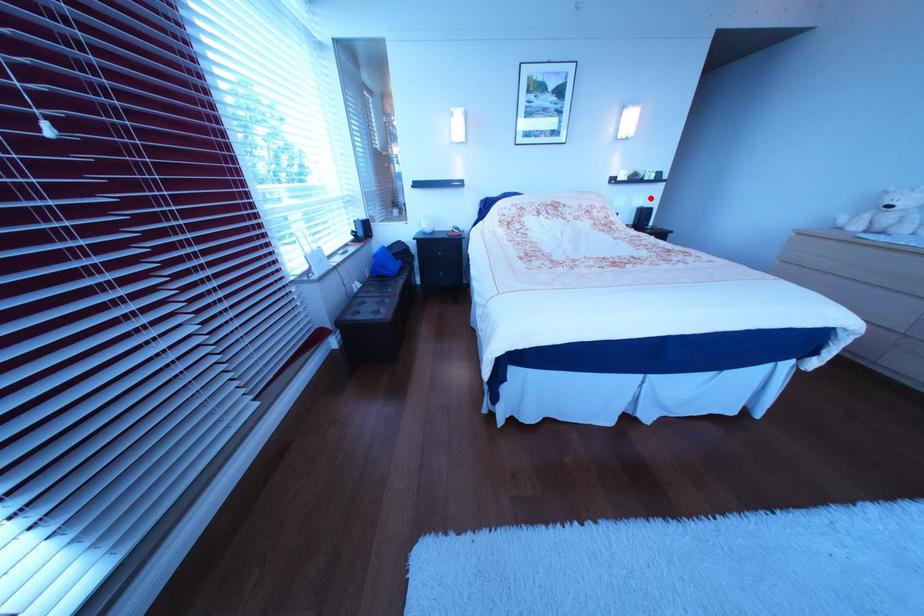
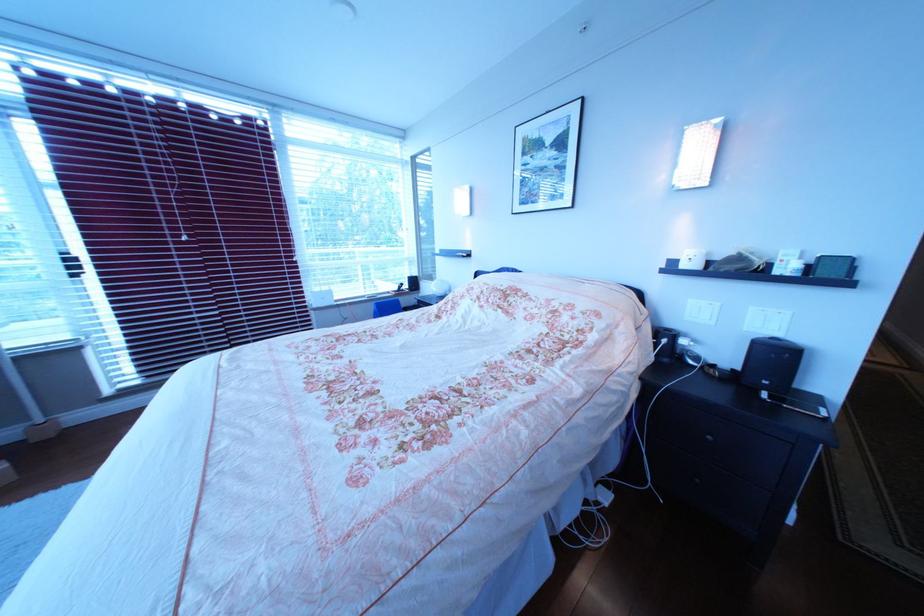
Locate, in the second image, the point that corresponds to the highlighted location in the first image.

(767, 310)